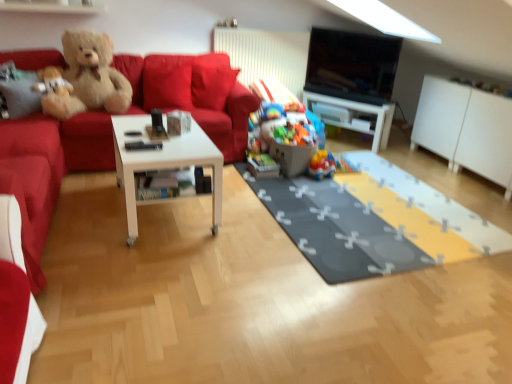
Question: Is plastic colorful toys at center, arranged as the second toy when viewed from the left, thinner than matte red couch at left?

Choices:
 (A) no
 (B) yes

Answer: (B)

Question: Is plastic colorful toys at center, arranged as the second toy when viewed from the left, far from matte red couch at left?

Choices:
 (A) yes
 (B) no

Answer: (B)

Question: From a real-world perspective, is plastic colorful toys at center, arranged as the second toy when viewed from the left, beneath matte red couch at left?

Choices:
 (A) yes
 (B) no

Answer: (A)

Question: Is plastic colorful toys at center, arranged as the second toy when viewed from the left, placed right next to matte red couch at left?

Choices:
 (A) yes
 (B) no

Answer: (B)

Question: Can you confirm if plastic colorful toys at center, marked as the second toy in a right-to-left arrangement, is smaller than matte red couch at left?

Choices:
 (A) yes
 (B) no

Answer: (A)

Question: Based on their positions, is fluffy beige teddy bear at upper left, the 1th teddy bear in the left-to-right sequence, located to the left or right of fluffy brown teddy bear at left, which is the 1th teddy bear in right-to-left order?

Choices:
 (A) right
 (B) left

Answer: (B)

Question: Do you think fluffy beige teddy bear at upper left, the 1th teddy bear in the left-to-right sequence, is within fluffy brown teddy bear at left, which is the 1th teddy bear in right-to-left order, or outside of it?

Choices:
 (A) inside
 (B) outside

Answer: (A)

Question: From a real-world perspective, is fluffy beige teddy bear at upper left, which is counted as the second teddy bear, starting from the right, above or below fluffy brown teddy bear at left, marked as the second teddy bear in a left-to-right arrangement?

Choices:
 (A) below
 (B) above

Answer: (A)

Question: Considering the positions of fluffy beige teddy bear at upper left, which is counted as the second teddy bear, starting from the right, and fluffy brown teddy bear at left, which is the 1th teddy bear in right-to-left order, in the image, is fluffy beige teddy bear at upper left, which is counted as the second teddy bear, starting from the right, wider or thinner than fluffy brown teddy bear at left, which is the 1th teddy bear in right-to-left order,?

Choices:
 (A) wide
 (B) thin

Answer: (B)

Question: Is white glossy coffee table at center taller or shorter than gray fabric mat at center?

Choices:
 (A) tall
 (B) short

Answer: (A)

Question: Would you say white glossy coffee table at center is to the left or to the right of gray fabric mat at center in the picture?

Choices:
 (A) left
 (B) right

Answer: (A)

Question: From the image's perspective, is white glossy coffee table at center located above or below gray fabric mat at center?

Choices:
 (A) above
 (B) below

Answer: (A)

Question: From a real-world perspective, relative to gray fabric mat at center, is white glossy coffee table at center vertically above or below?

Choices:
 (A) above
 (B) below

Answer: (A)

Question: Is point 309,147 closer or farther from the camera than point 62,150?

Choices:
 (A) closer
 (B) farther

Answer: (B)

Question: Is plastic colorful toys at center, marked as the second toy in a right-to-left arrangement, to the left or to the right of velvet red couch at left in the image?

Choices:
 (A) left
 (B) right

Answer: (B)